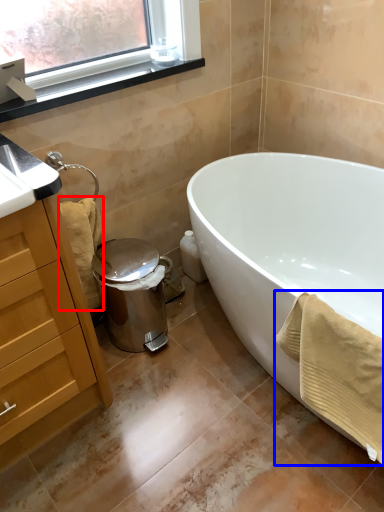
Question: Which point is closer to the camera, bath towel (highlighted by a red box) or bath towel (highlighted by a blue box)?

Choices:
 (A) bath towel
 (B) bath towel

Answer: (B)